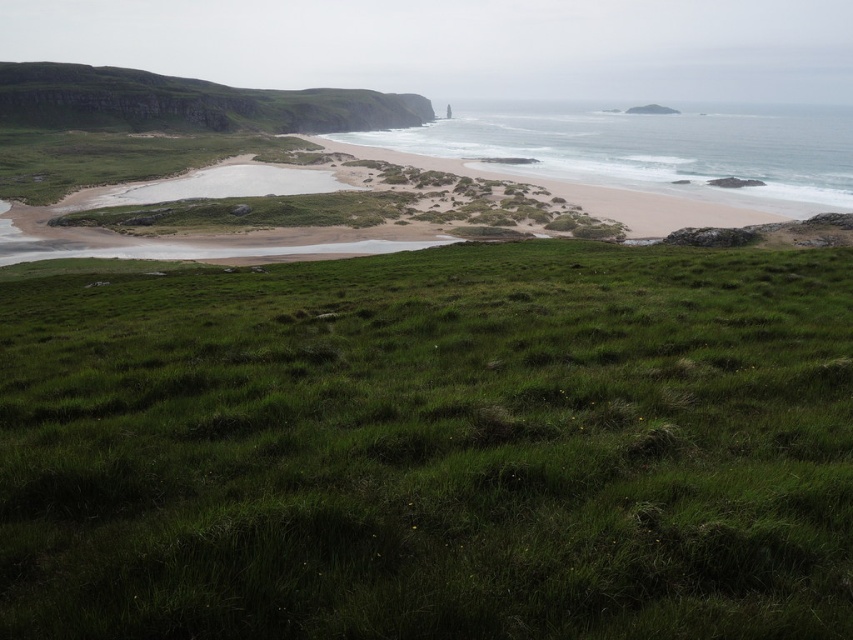
You are a hiker trying to cross the green grassy field at lower center and the green grassy hillside at upper left. Which path would require you to walk through taller grass?

The green grassy hillside at upper left has taller grass than the green grassy field at lower center, so walking through the green grassy hillside at upper left would require navigating taller grass.

You are a hiker planning to walk from the green grassy hillside at upper left to the green grassy field at lower center. Which direction should you move to reach your destination?

You should move downward from the green grassy hillside at upper left to reach the green grassy field at lower center since it is positioned under the hillside.